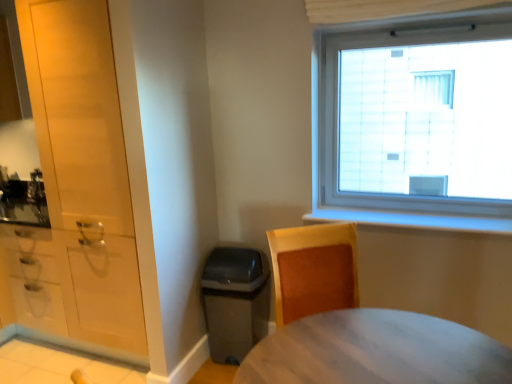
Question: Should I look upward or downward to see wooden desk at lower right?

Choices:
 (A) up
 (B) down

Answer: (B)

Question: Is the depth of matte white cabinet at left, acting as the 1th cabinetry starting from the right, less than that of matte white cabinets at left, acting as the 1th cabinetry starting from the left?

Choices:
 (A) no
 (B) yes

Answer: (B)

Question: Is matte white cabinet at left, acting as the 1th cabinetry starting from the right, shorter than matte white cabinets at left, acting as the 1th cabinetry starting from the left?

Choices:
 (A) no
 (B) yes

Answer: (A)

Question: Considering the relative sizes of matte white cabinet at left, acting as the 1th cabinetry starting from the right, and matte white cabinets at left, which ranks as the 2th cabinetry in right-to-left order, in the image provided, is matte white cabinet at left, acting as the 1th cabinetry starting from the right, smaller than matte white cabinets at left, which ranks as the 2th cabinetry in right-to-left order,?

Choices:
 (A) yes
 (B) no

Answer: (B)

Question: Considering the relative sizes of matte white cabinet at left, acting as the 1th cabinetry starting from the right, and matte white cabinets at left, acting as the 1th cabinetry starting from the left, in the image provided, is matte white cabinet at left, acting as the 1th cabinetry starting from the right, wider than matte white cabinets at left, acting as the 1th cabinetry starting from the left,?

Choices:
 (A) yes
 (B) no

Answer: (A)

Question: Is matte white cabinet at left, the 2th cabinetry from the left, far away from matte white cabinets at left, acting as the 1th cabinetry starting from the left?

Choices:
 (A) yes
 (B) no

Answer: (B)

Question: From the image's perspective, is matte white cabinet at left, acting as the 1th cabinetry starting from the right, over matte white cabinets at left, which ranks as the 2th cabinetry in right-to-left order?

Choices:
 (A) yes
 (B) no

Answer: (A)

Question: From the image's perspective, is matte white cabinet at left, acting as the 1th cabinetry starting from the right, below wooden desk at lower right?

Choices:
 (A) yes
 (B) no

Answer: (B)

Question: Could you tell me if matte white cabinet at left, the 2th cabinetry from the left, is turned towards wooden desk at lower right?

Choices:
 (A) no
 (B) yes

Answer: (A)

Question: Considering the relative positions of matte white cabinet at left, the 2th cabinetry from the left, and wooden desk at lower right in the image provided, is matte white cabinet at left, the 2th cabinetry from the left, behind wooden desk at lower right?

Choices:
 (A) yes
 (B) no

Answer: (A)

Question: Is matte white cabinet at left, acting as the 1th cabinetry starting from the right, wider than wooden desk at lower right?

Choices:
 (A) no
 (B) yes

Answer: (A)

Question: From a real-world perspective, is matte white cabinet at left, acting as the 1th cabinetry starting from the right, located higher than wooden desk at lower right?

Choices:
 (A) yes
 (B) no

Answer: (A)

Question: From a real-world perspective, is matte white cabinet at left, the 2th cabinetry from the left, under wooden desk at lower right?

Choices:
 (A) yes
 (B) no

Answer: (B)

Question: Is the position of wooden desk at lower right less distant than that of matte white cabinet at left, acting as the 1th cabinetry starting from the right?

Choices:
 (A) no
 (B) yes

Answer: (B)